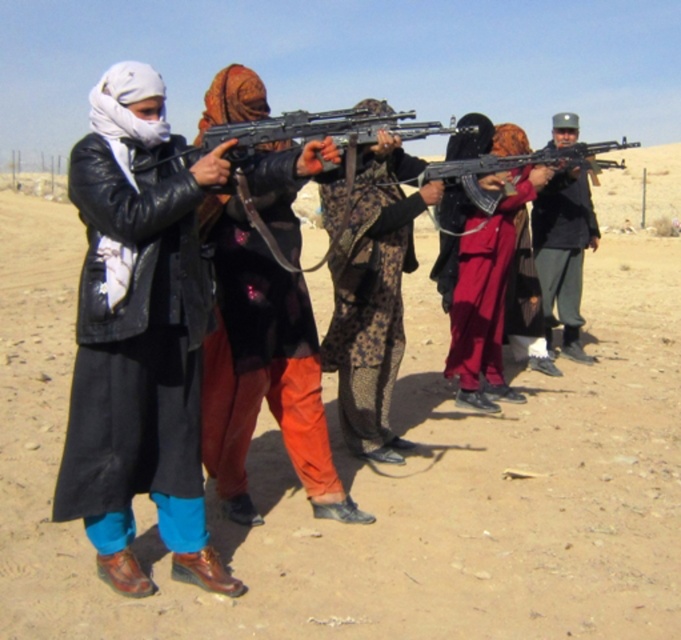
In the desert scene, where is the leather jacket at left located in terms of coordinates?

The leather jacket at left is located at point [138,340].

In the desert scene, there are two people with rifles. The first person is wearing a leather jacket at left, and the second person is wearing a dark coat over a patterned garment and orange pants. Which of these two people is positioned at the coordinate point (138,340)?

The leather jacket at left is located at point (138,340).

You are a photographer positioned at the camera. You want to capture a closeup shot of the leather jacket at left. Given that your camera can focus on objects within 5 feet, will you need to move closer or farther away to achieve this?

The leather jacket at left is 8.75 feet away from the camera. Since the camera can focus within 5 feet, you need to move closer to the leather jacket at left to get a closeup shot.